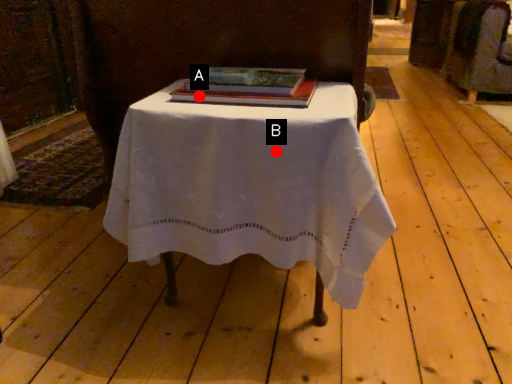
Question: Two points are circled on the image, labeled by A and B beside each circle. Which point is closer to the camera taking this photo?

Choices:
 (A) A is closer
 (B) B is closer

Answer: (B)